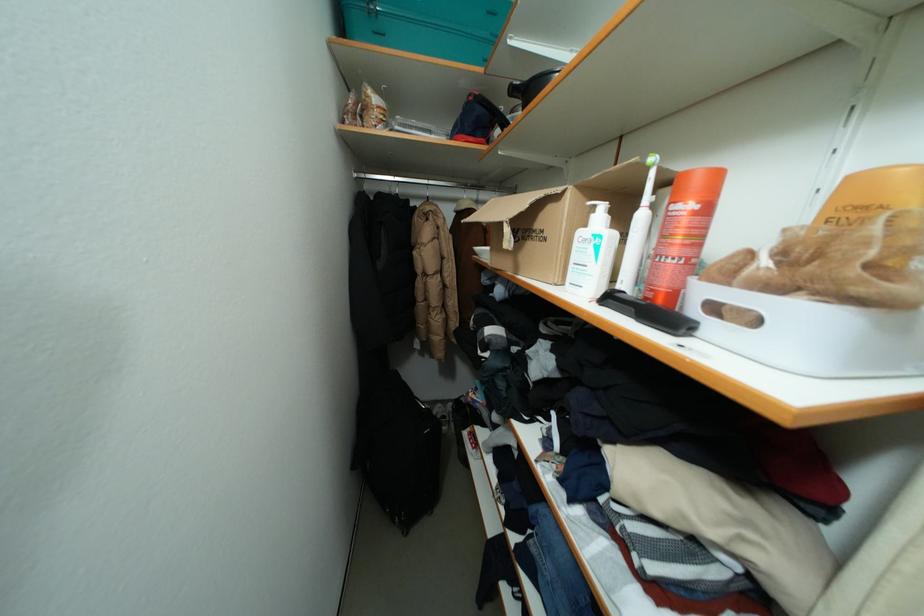
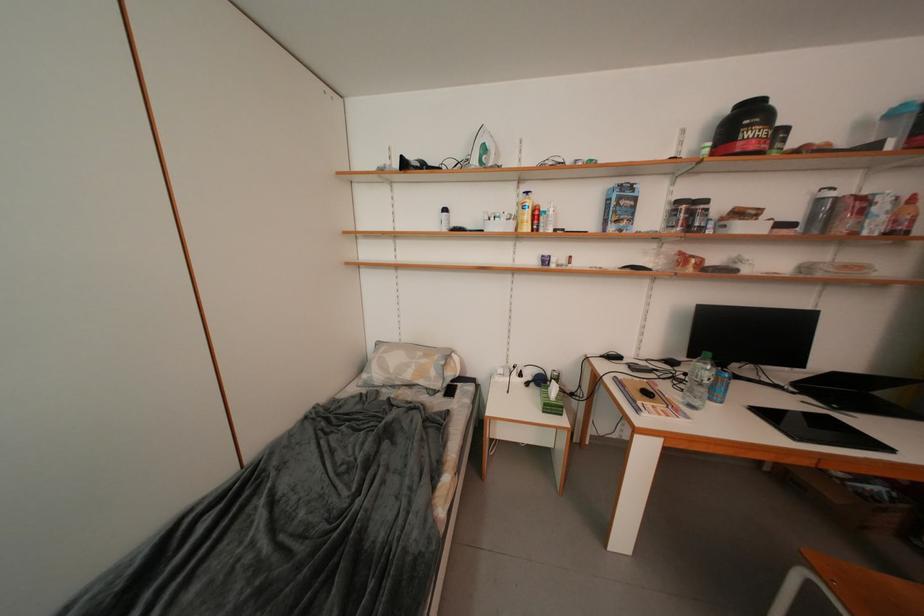
Question: The images are taken continuously from a first-person perspective. In which direction are you moving?

Choices:
 (A) Left
 (B) Right
 (C) Forward
 (D) Backward

Answer: (B)